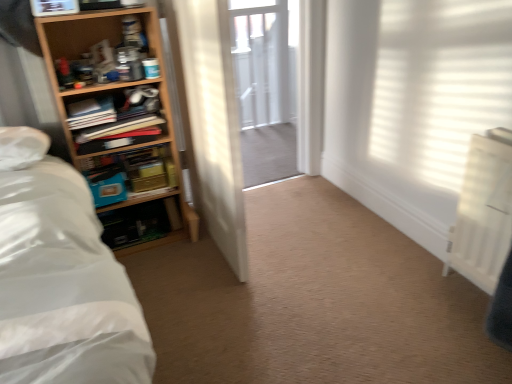
Question: In the image, is wooden bookshelf at left, positioned as the third shelf in top-to-bottom order, positioned in front of or behind wooden bookshelf at left, which is the 1th shelf from top to bottom?

Choices:
 (A) front
 (B) behind

Answer: (B)

Question: From their relative heights in the image, would you say wooden bookshelf at left, positioned as the third shelf in top-to-bottom order, is taller or shorter than wooden bookshelf at left, the 3th shelf in the bottom-to-top sequence?

Choices:
 (A) short
 (B) tall

Answer: (B)

Question: Considering the real-world distances, which object is closest to the wooden bookshelf at left, which is the 1th shelf from top to bottom?

Choices:
 (A) wooden bookshelf at left, positioned as the third shelf in top-to-bottom order
 (B) wooden bookshelf at left, which is the second shelf in top-to-bottom order
 (C) white painted wood door at center
 (D) clear glass screen door at center

Answer: (B)

Question: Estimate the real-world distances between objects in this image. Which object is farther from the clear glass screen door at center?

Choices:
 (A) wooden bookshelf at left, which is the 1th shelf from top to bottom
 (B) wooden bookshelf at left, positioned as the 1th shelf in bottom-to-top order
 (C) wooden bookshelf at left, which is the second shelf in top-to-bottom order
 (D) white painted wood door at center

Answer: (A)